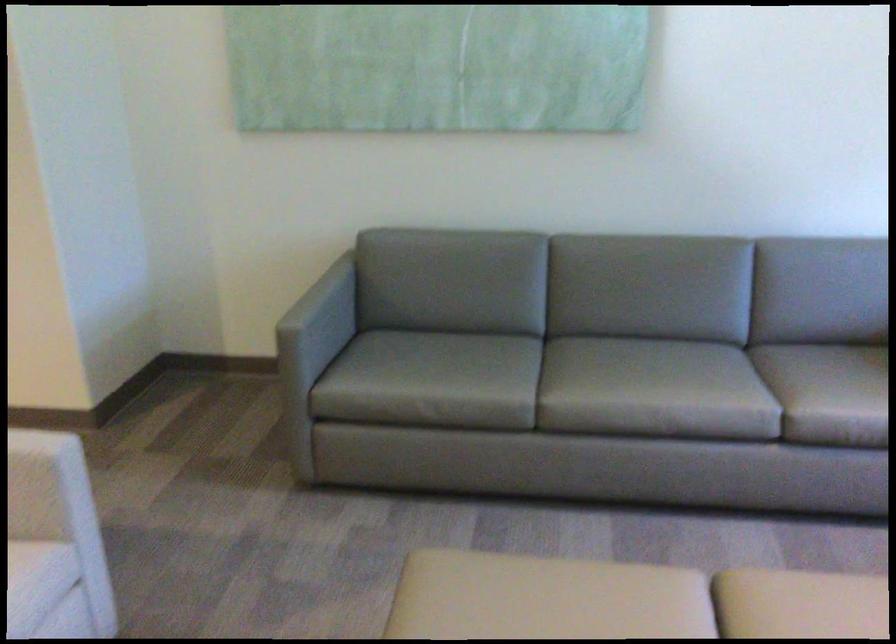
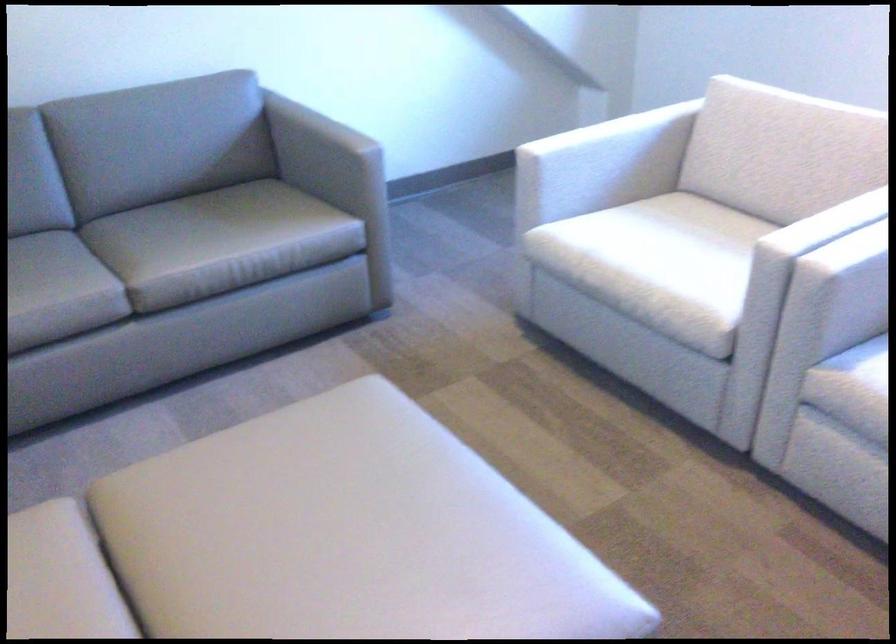
Question: The images are taken continuously from a first-person perspective. In which direction is your viewpoint rotating?

Choices:
 (A) Left
 (B) Right
 (C) Up
 (D) Down

Answer: (B)